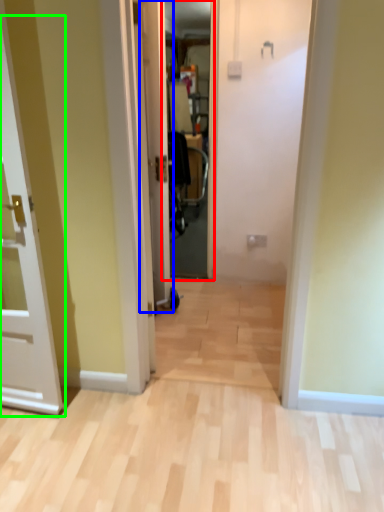
Question: Considering the real-world distances, which object is farthest from screen door (highlighted by a red box)? door (highlighted by a blue box) or door (highlighted by a green box)?

Choices:
 (A) door
 (B) door

Answer: (B)